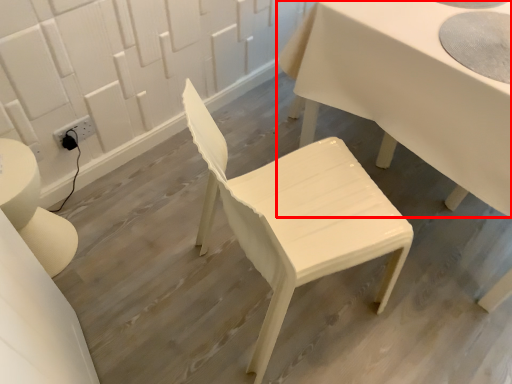
Question: From the image's perspective, where is table (annotated by the red box) located in relation to chair in the image?

Choices:
 (A) above
 (B) below

Answer: (A)